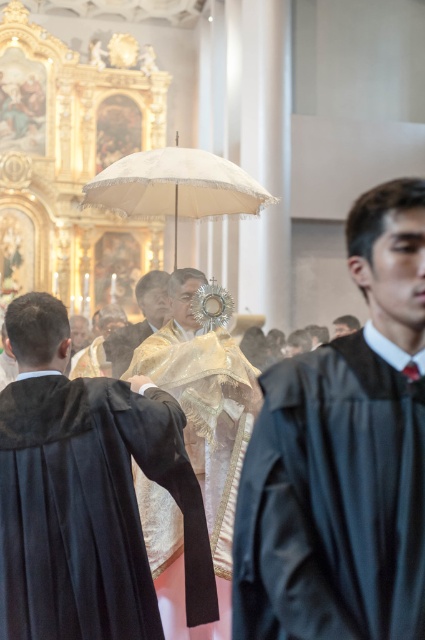
Is velvet black robe at center to the left of white lace umbrella at center from the viewer's perspective?

Indeed, velvet black robe at center is positioned on the left side of white lace umbrella at center.

Is velvet black robe at center to the right of white lace umbrella at center from the viewer's perspective?

No, velvet black robe at center is not to the right of white lace umbrella at center.

The image size is (425, 640). I want to click on velvet black robe at center, so click(x=90, y=509).

This screenshot has width=425, height=640. Find the location of `velvet black robe at center`. velvet black robe at center is located at coordinates (90, 509).

Based on the photo, who is positioned more to the right, smooth black robe at center or velvet black robe at center?

Positioned to the right is smooth black robe at center.

The height and width of the screenshot is (640, 425). Describe the element at coordinates (343, 458) in the screenshot. I see `smooth black robe at center` at that location.

Locate an element on the screen. smooth black robe at center is located at coordinates (343, 458).

Which is behind, point (27, 520) or point (176, 323)?

Positioned behind is point (176, 323).

Does velvet black robe at center appear under shiny gold robe at center?

Yes.

Where is `velvet black robe at center`? velvet black robe at center is located at coordinates (90, 509).